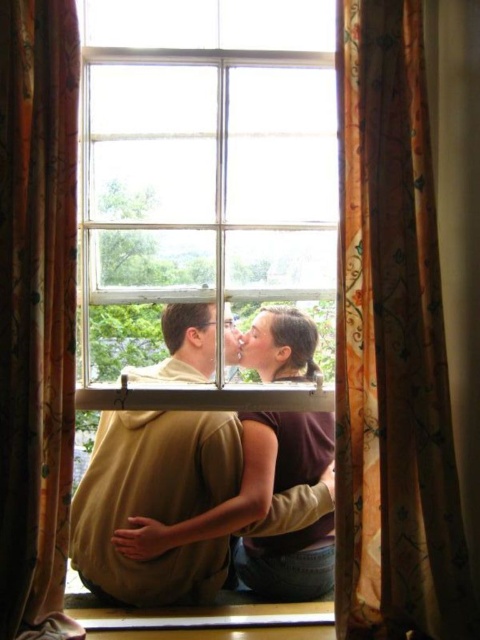
You are an interior designer assessing the decor of this room. You notice the brown fabric hair at center and the wooden at lower center. Which object is positioned to the right side of the other?

The brown fabric hair at center is to the right of wooden at lower center.

You are standing in the room and notice two points marked in the scene. Which point is closer to you, point (268, 547) or point (327, 621)?

Point (268, 547) is closer to you than point (327, 621) because it is further to the viewer.